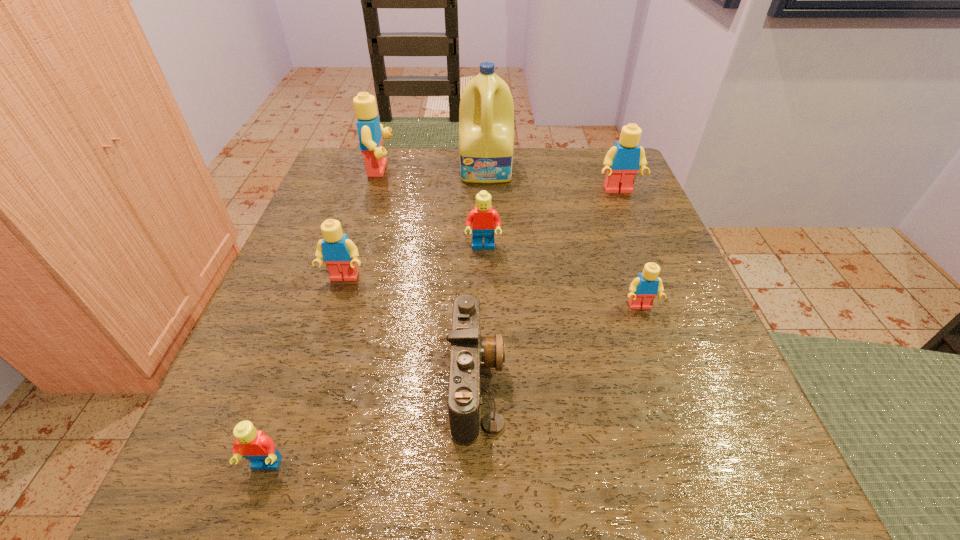
Locate an element on the screen. The height and width of the screenshot is (540, 960). free point located on the front-facing side of the third nearest object is located at coordinates (659, 360).

This screenshot has height=540, width=960. Find the location of `detergent located at the far edge`. detergent located at the far edge is located at coordinates (486, 114).

The image size is (960, 540). I want to click on camera situated at the near edge, so click(469, 352).

Image resolution: width=960 pixels, height=540 pixels. I want to click on Lego positioned at the near edge, so click(x=255, y=446).

At what (x,y) coordinates should I click in order to perform the action: click on object situated at the far left corner. Please return your answer as a coordinate pair (x, y). The image size is (960, 540). Looking at the image, I should click on (370, 131).

Identify the location of object present at the near left corner. Image resolution: width=960 pixels, height=540 pixels. (255, 446).

This screenshot has width=960, height=540. Find the location of `object situated at the far right corner`. object situated at the far right corner is located at coordinates (622, 161).

In the image, there is a desktop. Where is `free region at the far edge`? The width and height of the screenshot is (960, 540). free region at the far edge is located at coordinates (554, 158).

The height and width of the screenshot is (540, 960). Identify the location of blank space at the near edge. pyautogui.click(x=509, y=444).

Where is `free space at the right edge`? free space at the right edge is located at coordinates (624, 332).